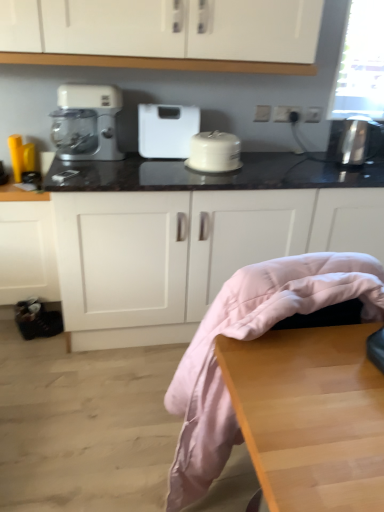
Locate an element on the screen. This screenshot has width=384, height=512. vacant space in front of white plastic mixer at left is located at coordinates (84, 161).